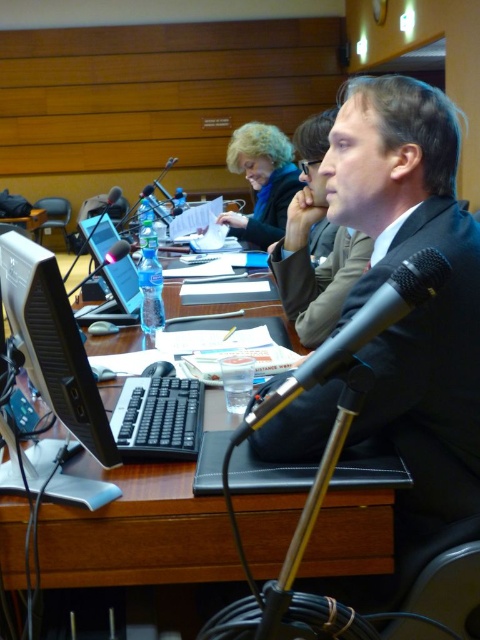
Who is higher up, brown suit at center or matte black jacket at upper center?

matte black jacket at upper center is above.

Where is `brown suit at center`? Image resolution: width=480 pixels, height=640 pixels. brown suit at center is located at coordinates pos(309,244).

You are a GUI agent. You are given a task and a screenshot of the screen. Output one action in this format:
    pyautogui.click(x=<x>, y=<y>)
    Task: Click on the brown suit at center
    Image resolution: width=480 pixels, height=640 pixels.
    Given the screenshot: What is the action you would take?
    pyautogui.click(x=309, y=244)

The width and height of the screenshot is (480, 640). Identify the location of brown suit at center. (309, 244).

Does black glossy monitor at center appear on the left side of matte black jacket at upper center?

Indeed, black glossy monitor at center is positioned on the left side of matte black jacket at upper center.

Does point (31, 323) come behind point (252, 216)?

No.

Where is `black glossy monitor at center`? black glossy monitor at center is located at coordinates 54,342.

In the scene shown: Is black metallic microphone at center wider than matte black jacket at upper center?

Incorrect, black metallic microphone at center's width does not surpass matte black jacket at upper center's.

The width and height of the screenshot is (480, 640). Identify the location of black metallic microphone at center. (355, 340).